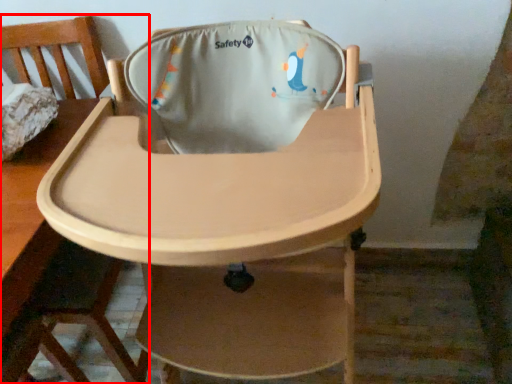
Question: In this image, where is chair (annotated by the red box) located relative to chair?

Choices:
 (A) right
 (B) left

Answer: (B)